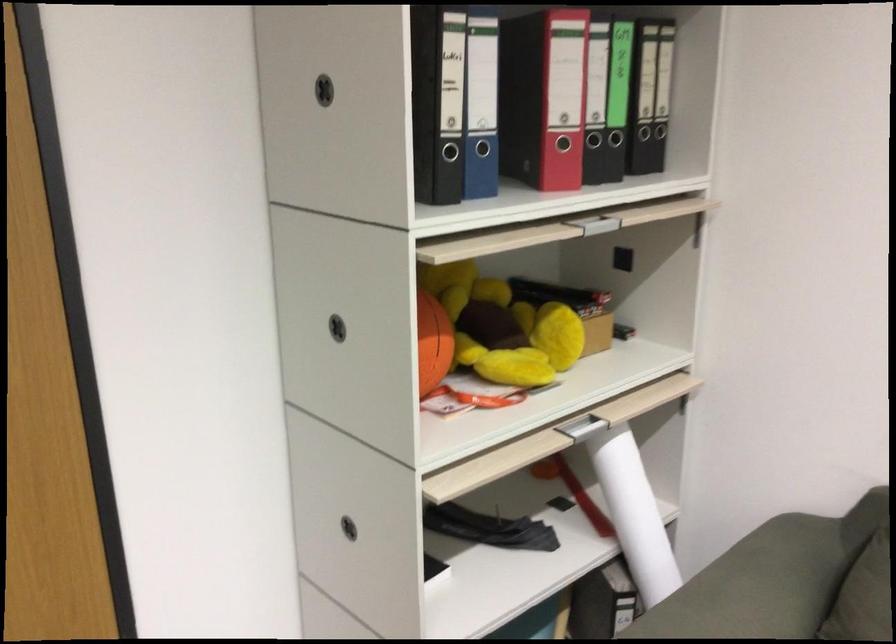
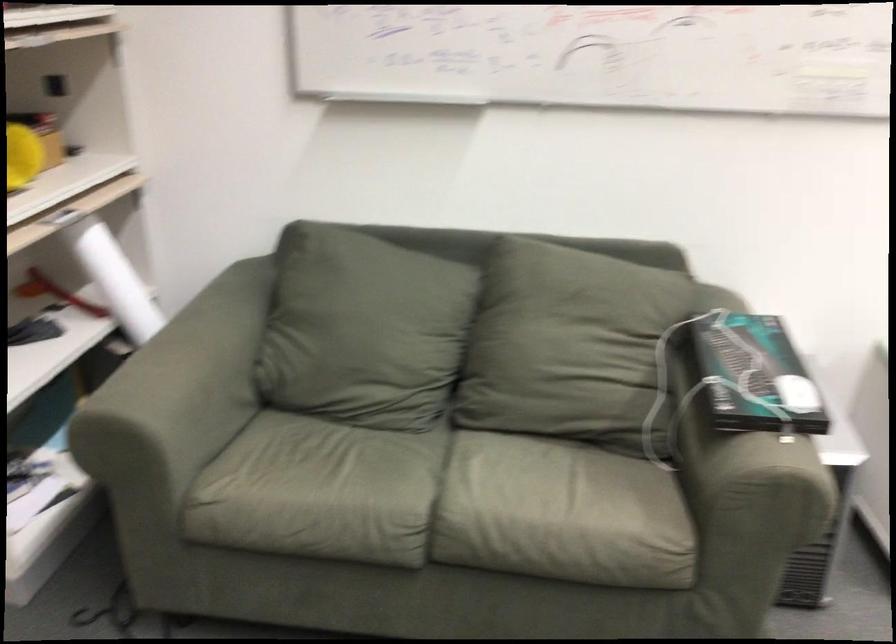
Question: The images are taken continuously from a first-person perspective. In which direction is your viewpoint rotating?

Choices:
 (A) Left
 (B) Right
 (C) Up
 (D) Down

Answer: (B)